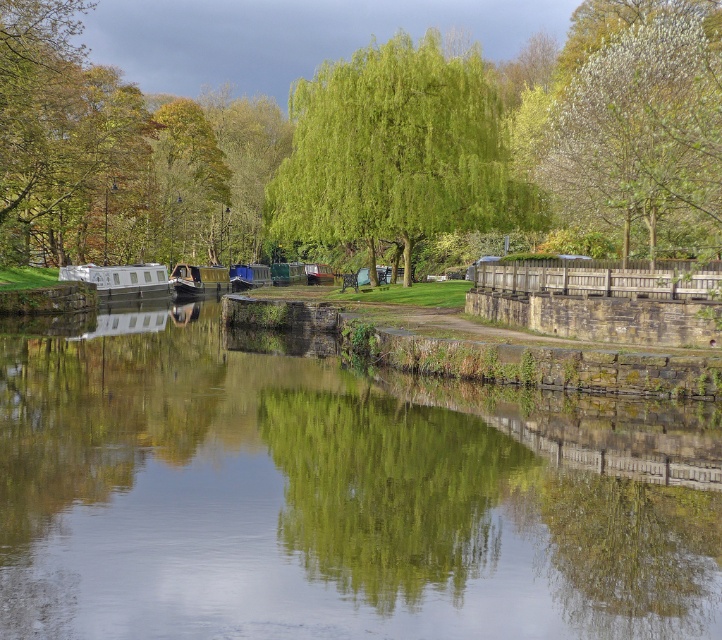
Is point (562, 406) more distant than point (77, 269)?

No, (562, 406) is in front of (77, 269).

Does green stone river at center have a lesser height compared to white glossy boat at left?

Yes.

Is point (265, 429) positioned in front of point (100, 266)?

Yes, it is.

This screenshot has width=722, height=640. Find the location of `green stone river at center`. green stone river at center is located at coordinates (336, 497).

Which is in front, point (425, 156) or point (180, 292)?

Point (425, 156)

Find the location of a particular element. This screenshot has height=640, width=722. green leafy tree at center is located at coordinates (396, 152).

Does point (404, 260) lie in front of point (180, 296)?

Yes.

Identify the location of green leafy tree at center. Image resolution: width=722 pixels, height=640 pixels. (396, 152).

Can you confirm if white fluffy tree at upper right is taller than wooden boat at center?

Yes, white fluffy tree at upper right is taller than wooden boat at center.

Is white fluffy tree at upper right above wooden boat at center?

Indeed, white fluffy tree at upper right is positioned over wooden boat at center.

This screenshot has width=722, height=640. I want to click on white fluffy tree at upper right, so click(x=635, y=122).